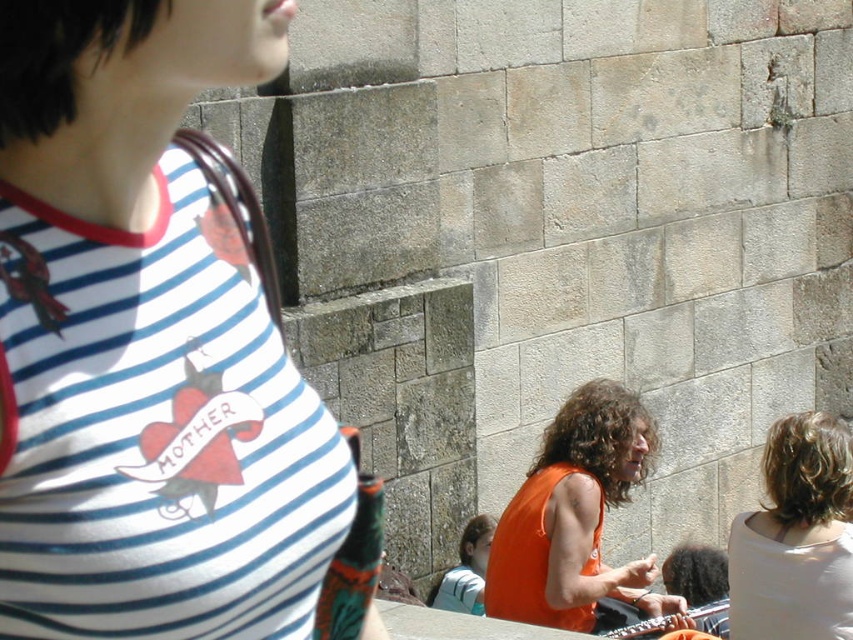
Question: Is white striped tank top at upper left positioned in front of white matte hair at upper right?

Choices:
 (A) yes
 (B) no

Answer: (A)

Question: Which point is farther from the camera taking this photo?

Choices:
 (A) (563, 593)
 (B) (276, 538)

Answer: (A)

Question: Which of the following is the farthest from the observer?

Choices:
 (A) orange sleeveless top at center
 (B) white matte hair at upper right
 (C) white striped tank top at upper left
 (D) light blue fabric shirt at lower center

Answer: (D)

Question: Is white striped tank top at upper left further to camera compared to light blue fabric shirt at lower center?

Choices:
 (A) yes
 (B) no

Answer: (B)

Question: Can you confirm if white striped tank top at upper left is positioned below white matte hair at upper right?

Choices:
 (A) no
 (B) yes

Answer: (A)

Question: Which point is closer to the camera taking this photo?

Choices:
 (A) (457, 564)
 (B) (821, 576)
 (C) (137, 624)
 (D) (639, 596)

Answer: (C)